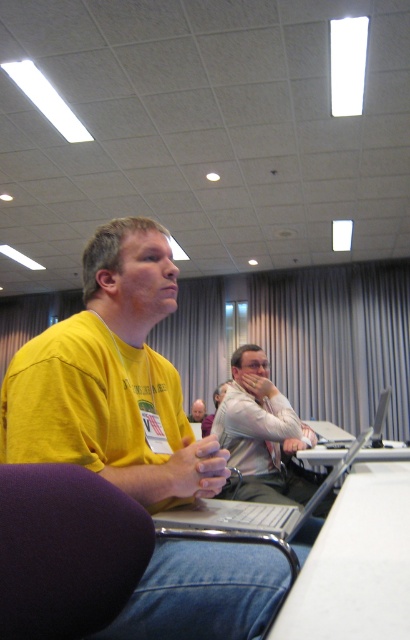
You are standing in the conference room and see the yellow t shirt at center. Where exactly is the yellow t shirt located in relation to the point marked at coordinates [111,380]?

The yellow t shirt at center is located exactly at the point marked at coordinates [111,380].